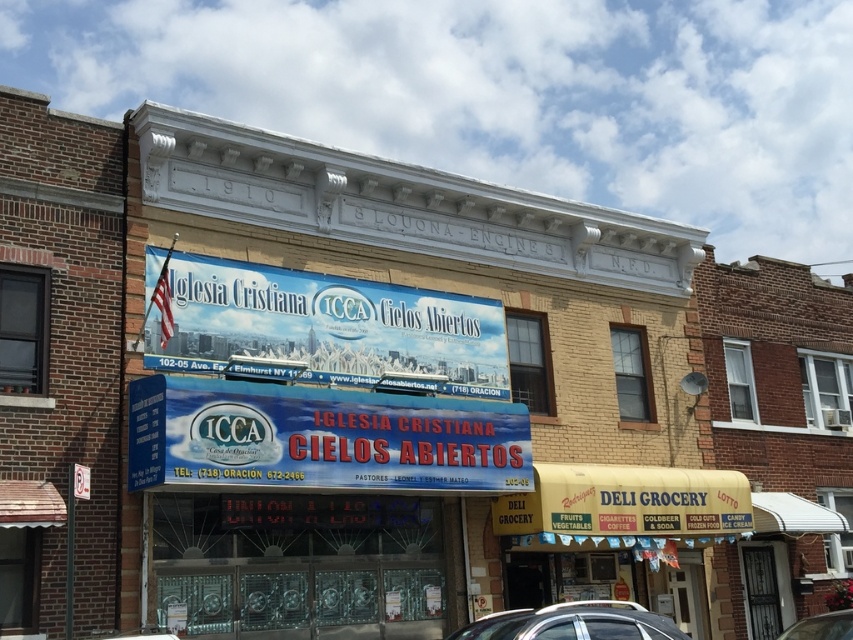
You are a delivery person trying to park your silver metallic car at lower center close to the blue fabric sign at center for unloading. According to the scene, is there enough space between them to open the car doors?

The blue fabric sign at center is 12.15 feet from the silver metallic car at lower center. Since car doors typically require about 3 feet of clearance to open fully, there is ample space between them for the doors to open without any issues.

You are a delivery person trying to park your silver metallic car at lower center in front of the blue fabric sign at center. Can you park your car there without moving the sign?

The blue fabric sign at center is positioned on the left side of the silver metallic car at lower center, so the car is already parked in front of the sign. Therefore, you can park there without moving the sign.